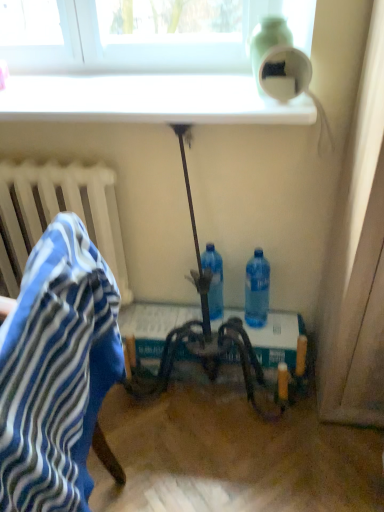
The width and height of the screenshot is (384, 512). I want to click on white glossy window sill at upper center, so click(x=149, y=100).

This screenshot has height=512, width=384. Describe the element at coordinates (268, 40) in the screenshot. I see `green matte bottle at upper right, which is counted as the 1th bottle, starting from the top` at that location.

The width and height of the screenshot is (384, 512). Describe the element at coordinates (149, 99) in the screenshot. I see `metallic silver table at center` at that location.

This screenshot has width=384, height=512. I want to click on white glossy window sill at upper center, so click(x=149, y=100).

Is point (48, 93) farther from camera compared to point (270, 44)?

Yes, it is behind point (270, 44).

Is metallic silver table at center placed right next to green matte bottle at upper right, which is counted as the 1th bottle, starting from the top?

No, metallic silver table at center is not beside green matte bottle at upper right, which is counted as the 1th bottle, starting from the top.

From a real-world perspective, is metallic silver table at center on green matte bottle at upper right, which is counted as the 1th bottle, starting from the top?

No, from a real-world perspective, metallic silver table at center is not on top of green matte bottle at upper right, which is counted as the 1th bottle, starting from the top.

Where is `bottle above the metallic silver table at center (from the image's perspective)`? The height and width of the screenshot is (512, 384). bottle above the metallic silver table at center (from the image's perspective) is located at coordinates (268, 40).

Is blue plastic bottle at lower center, which is the third bottle in top-to-bottom order, next to white glossy window sill at upper center?

No, blue plastic bottle at lower center, which is the third bottle in top-to-bottom order, is not beside white glossy window sill at upper center.

Is blue plastic bottle at lower center, the 1th bottle positioned from the bottom, taller than white glossy window sill at upper center?

Yes, blue plastic bottle at lower center, the 1th bottle positioned from the bottom, is taller than white glossy window sill at upper center.

Does blue plastic bottle at lower center, which is the third bottle in top-to-bottom order, turn towards white glossy window sill at upper center?

No, blue plastic bottle at lower center, which is the third bottle in top-to-bottom order, is not facing towards white glossy window sill at upper center.

Can you tell me how much blue plastic bottle at lower center, the 1th bottle positioned from the bottom, and white glossy window sill at upper center differ in facing direction?

The angle between the facing direction of blue plastic bottle at lower center, the 1th bottle positioned from the bottom, and the facing direction of white glossy window sill at upper center is 1.04 degrees.

Does white glossy window sill at upper center lie behind metallic silver table at center?

Yes.

Considering the relative sizes of white glossy window sill at upper center and metallic silver table at center in the image provided, is white glossy window sill at upper center taller than metallic silver table at center?

No, white glossy window sill at upper center is not taller than metallic silver table at center.

Does white glossy window sill at upper center have a larger size compared to metallic silver table at center?

Incorrect, white glossy window sill at upper center is not larger than metallic silver table at center.

Choose the correct answer: Is white glossy window sill at upper center inside metallic silver table at center or outside it?

The correct answer is: outside.

Is the position of blue striped fabric at left more distant than that of translucent plastic bottle at center, placed as the second bottle when sorted from bottom to top?

No, it is not.

How much distance is there between blue striped fabric at left and translucent plastic bottle at center, placed as the second bottle when sorted from bottom to top?

32.49 inches.

Considering the positions of point (66, 263) and point (212, 264), is point (66, 263) closer or farther from the camera than point (212, 264)?

Point (66, 263) is positioned closer to the camera compared to point (212, 264).

Considering the relative sizes of green matte bottle at upper right, which is counted as the 1th bottle, starting from the top, and white glossy window sill at upper center in the image provided, is green matte bottle at upper right, which is counted as the 1th bottle, starting from the top, bigger than white glossy window sill at upper center?

Incorrect, green matte bottle at upper right, which is counted as the 1th bottle, starting from the top, is not larger than white glossy window sill at upper center.

Are green matte bottle at upper right, placed as the third bottle when sorted from bottom to top, and white glossy window sill at upper center making contact?

green matte bottle at upper right, placed as the third bottle when sorted from bottom to top, and white glossy window sill at upper center are clearly separated.

Which object is wider, green matte bottle at upper right, placed as the third bottle when sorted from bottom to top, or white glossy window sill at upper center?

white glossy window sill at upper center is wider.

Which point is more forward, (251, 51) or (38, 101)?

The point (251, 51) is more forward.

Is translucent plastic bottle at center, the second bottle in the top-to-bottom sequence, completely or partially inside blue plastic bottle at lower center, the 1th bottle positioned from the bottom?

No, translucent plastic bottle at center, the second bottle in the top-to-bottom sequence, is located outside of blue plastic bottle at lower center, the 1th bottle positioned from the bottom.

From a real-world perspective, is blue plastic bottle at lower center, the 1th bottle positioned from the bottom, on top of translucent plastic bottle at center, placed as the second bottle when sorted from bottom to top?

Indeed, from a real-world perspective, blue plastic bottle at lower center, the 1th bottle positioned from the bottom, stands above translucent plastic bottle at center, placed as the second bottle when sorted from bottom to top.

From the image's perspective, is blue plastic bottle at lower center, the 1th bottle positioned from the bottom, on translucent plastic bottle at center, placed as the second bottle when sorted from bottom to top?

No, from the image's perspective, blue plastic bottle at lower center, the 1th bottle positioned from the bottom, is not over translucent plastic bottle at center, placed as the second bottle when sorted from bottom to top.

From a real-world perspective, which bottle is the 1st one above the translucent plastic bottle at center, placed as the second bottle when sorted from bottom to top? Please provide its 2D coordinates.

[(257, 290)]

Based on their sizes in the image, would you say white glossy window sill at upper center is bigger or smaller than blue striped fabric at left?

Clearly, white glossy window sill at upper center is smaller in size than blue striped fabric at left.

Is white glossy window sill at upper center inside the boundaries of blue striped fabric at left, or outside?

white glossy window sill at upper center is located beyond the bounds of blue striped fabric at left.

Considering the relative positions of white glossy window sill at upper center and blue striped fabric at left in the image provided, is white glossy window sill at upper center to the left or to the right of blue striped fabric at left?

From the image, it's evident that white glossy window sill at upper center is to the right of blue striped fabric at left.

In the scene shown: Is white glossy window sill at upper center facing towards blue striped fabric at left?

No, white glossy window sill at upper center is not facing towards blue striped fabric at left.

Image resolution: width=384 pixels, height=512 pixels. I want to click on table in front of the green matte bottle at upper right, which is counted as the 1th bottle, starting from the top, so click(x=149, y=99).

Where is `window sill above the blue plastic bottle at lower center, which is the third bottle in top-to-bottom order (from a real-world perspective)`? The image size is (384, 512). window sill above the blue plastic bottle at lower center, which is the third bottle in top-to-bottom order (from a real-world perspective) is located at coordinates (149, 100).

In the scene shown: Based on their spatial positions, is metallic silver table at center or translucent plastic bottle at center, the second bottle in the top-to-bottom sequence, closer to blue plastic bottle at lower center, the 1th bottle positioned from the bottom?

Among the two, translucent plastic bottle at center, the second bottle in the top-to-bottom sequence, is located nearer to blue plastic bottle at lower center, the 1th bottle positioned from the bottom.

Which object lies nearer to the anchor point green matte bottle at upper right, which is counted as the 1th bottle, starting from the top, blue striped fabric at left or metallic silver table at center?

metallic silver table at center lies closer to green matte bottle at upper right, which is counted as the 1th bottle, starting from the top, than the other object.

Which object lies further to the anchor point metallic silver table at center, blue plastic bottle at lower center, which is the third bottle in top-to-bottom order, or green matte bottle at upper right, which is counted as the 1th bottle, starting from the top?

blue plastic bottle at lower center, which is the third bottle in top-to-bottom order, is further to metallic silver table at center.

Which object lies further to the anchor point green matte bottle at upper right, placed as the third bottle when sorted from bottom to top, blue plastic bottle at lower center, which is the third bottle in top-to-bottom order, or metallic silver table at center?

The object further to green matte bottle at upper right, placed as the third bottle when sorted from bottom to top, is blue plastic bottle at lower center, which is the third bottle in top-to-bottom order.

From the image, which object appears to be nearer to blue striped fabric at left, metallic silver table at center or blue plastic bottle at lower center, which is the third bottle in top-to-bottom order?

metallic silver table at center.

Considering their positions, is green matte bottle at upper right, which is counted as the 1th bottle, starting from the top, positioned further to blue striped fabric at left than metallic silver table at center?

green matte bottle at upper right, which is counted as the 1th bottle, starting from the top.

Based on the photo, from the image, which object appears to be farther from blue striped fabric at left, green matte bottle at upper right, placed as the third bottle when sorted from bottom to top, or white glossy window sill at upper center?

The object further to blue striped fabric at left is green matte bottle at upper right, placed as the third bottle when sorted from bottom to top.

Which object lies nearer to the anchor point translucent plastic bottle at center, the second bottle in the top-to-bottom sequence, metallic silver table at center or green matte bottle at upper right, placed as the third bottle when sorted from bottom to top?

metallic silver table at center.

Find the location of `window sill between blue striped fabric at left and blue plastic bottle at lower center, which is the third bottle in top-to-bottom order, along the z-axis`. window sill between blue striped fabric at left and blue plastic bottle at lower center, which is the third bottle in top-to-bottom order, along the z-axis is located at coordinates (149, 100).

You are a GUI agent. You are given a task and a screenshot of the screen. Output one action in this format:
    pyautogui.click(x=<x>, y=<y>)
    Task: Click on the window sill between green matte bottle at upper right, placed as the third bottle when sorted from bottom to top, and metallic silver table at center vertically
    The image size is (384, 512).
    Given the screenshot: What is the action you would take?
    pyautogui.click(x=149, y=100)

Locate an element on the screen. table between blue striped fabric at left and blue plastic bottle at lower center, the 1th bottle positioned from the bottom, along the z-axis is located at coordinates (149, 99).

I want to click on table between white glossy window sill at upper center and translucent plastic bottle at center, the second bottle in the top-to-bottom sequence, from top to bottom, so click(x=149, y=99).